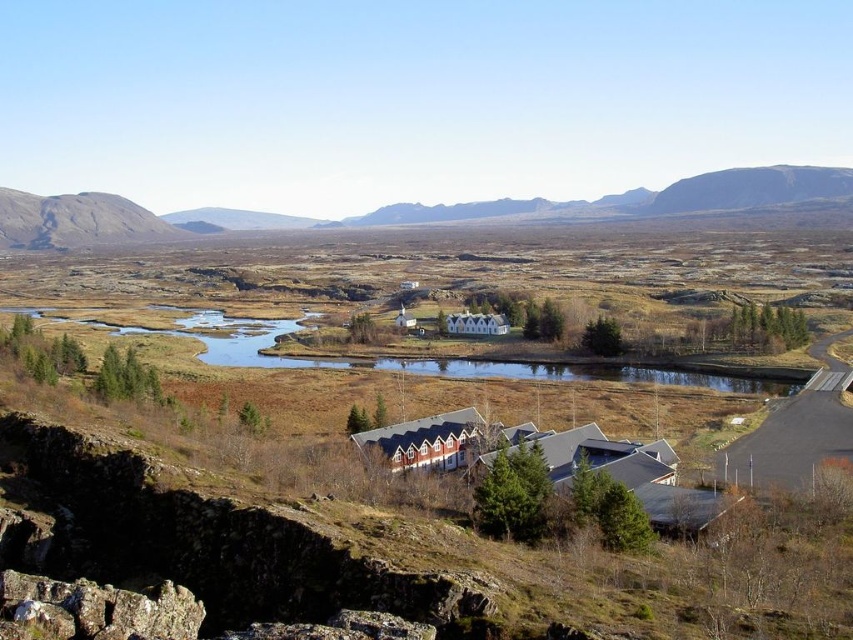
You are a hiker who has reached the point with coordinates (627, 474). What structure can you see exactly at your current location?

At point (627, 474) lies blue corrugated metal building at center.

You are planning to cross the green grassy lake at center and the rugged rock mountain at left. Which path would require a wider bridge to be built?

The green grassy lake at center requires a wider bridge because its width is larger than the rugged rock mountain at left.

You are standing in the landscape and want to reach the point at the bottom of the image. Which of the two points, point (699, 502) or point (222, 349), is closer to you?

Point (222, 349) is closer to you because it is located at the bottom of the image, which is typically where the viewer is positioned.